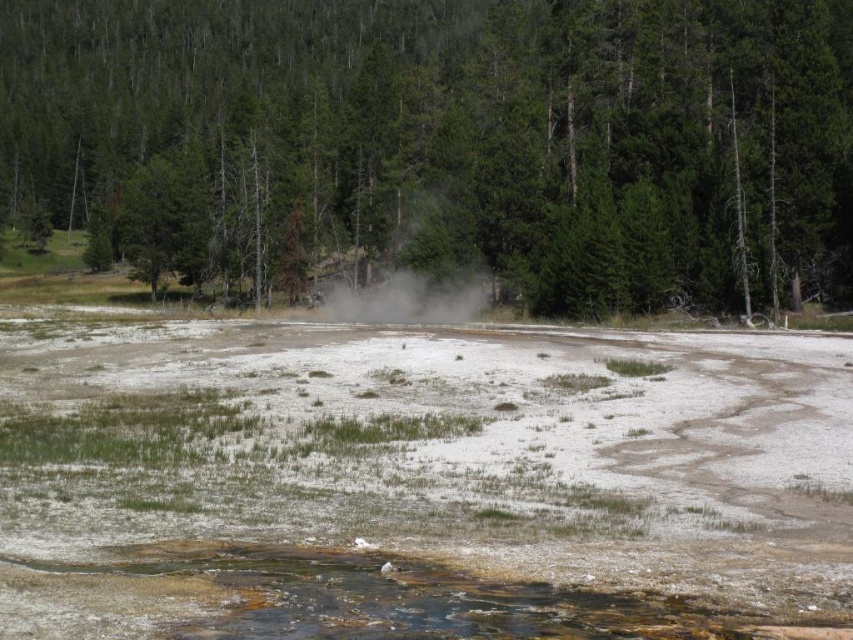
Is point (671, 216) farther from camera compared to point (419, 291)?

No, it is not.

Is green matte tree at center above white dusty steam at center?

Indeed, green matte tree at center is positioned over white dusty steam at center.

Identify the location of green matte tree at center. (442, 144).

Which is below, white sedimentary water at center or white dusty steam at center?

white sedimentary water at center

Is white sedimentary water at center positioned behind white dusty steam at center?

No, white sedimentary water at center is closer to the viewer.

Who is more forward, (438,509) or (482,291)?

Point (438,509) is more forward.

Locate an element on the screen. white sedimentary water at center is located at coordinates (419, 483).

Between white sedimentary water at center and green matte tree at center, which one has more height?

green matte tree at center

Consider the image. Is white sedimentary water at center positioned in front of green matte tree at center?

Yes, it is.

Where is `white sedimentary water at center`? white sedimentary water at center is located at coordinates (419, 483).